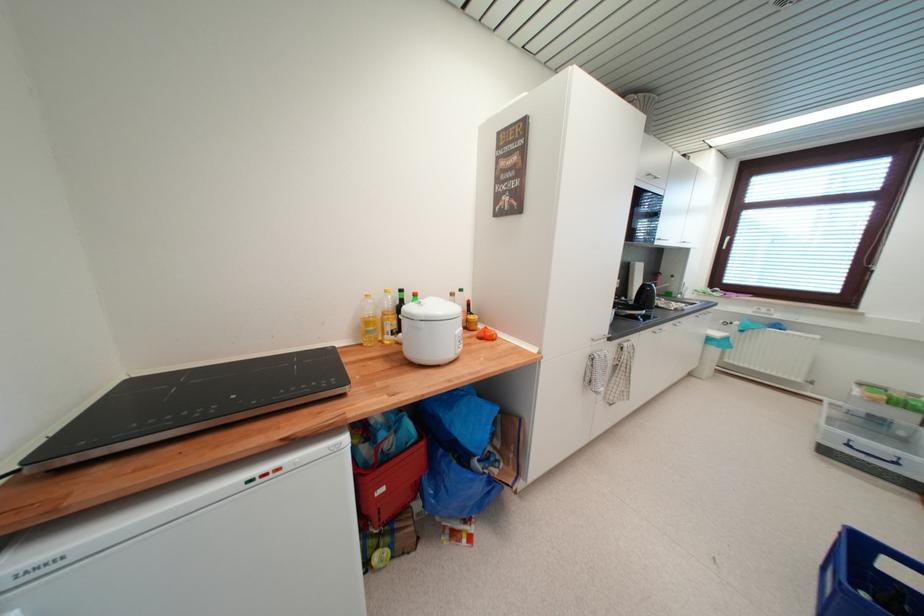
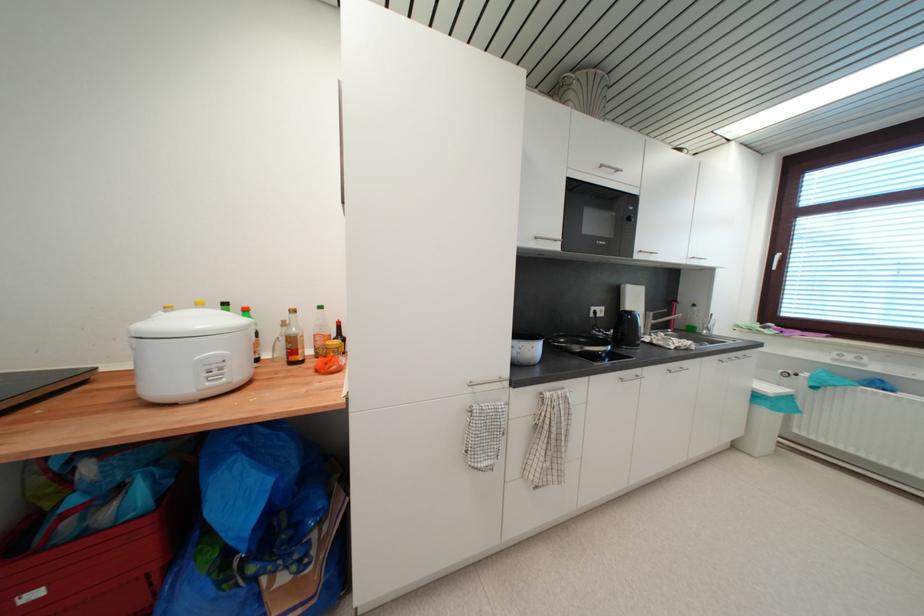
The point at (678, 292) is marked in the first image. Where is the corresponding point in the second image?

(701, 326)